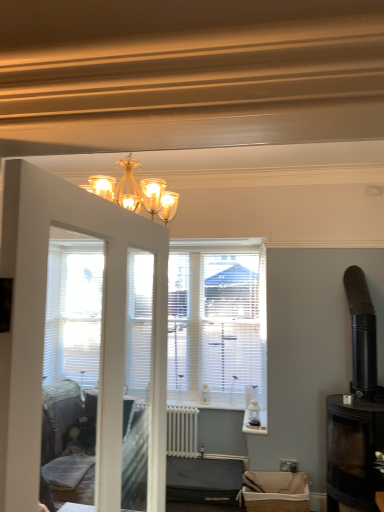
Find the location of a particular element. burlap basket at lower center, placed as the first furniture when sorted from right to left is located at coordinates (276, 490).

This screenshot has height=512, width=384. Describe the element at coordinates (276, 490) in the screenshot. I see `burlap basket at lower center, which ranks as the 2th furniture in left-to-right order` at that location.

What do you see at coordinates (182, 431) in the screenshot? The width and height of the screenshot is (384, 512). I see `white painted radiator at center` at bounding box center [182, 431].

You are a GUI agent. You are given a task and a screenshot of the screen. Output one action in this format:
    pyautogui.click(x=<x>, y=<y>)
    Task: Click on the gold metallic chandelier at upper center
    The width and height of the screenshot is (384, 512).
    Given the screenshot: What is the action you would take?
    pyautogui.click(x=74, y=329)

Locate an element on the screen. The width and height of the screenshot is (384, 512). burlap basket at lower center, placed as the first furniture when sorted from right to left is located at coordinates (276, 490).

In the scene shown: How distant is white painted radiator at center from black glass fireplace at right?

white painted radiator at center is 5.94 feet away from black glass fireplace at right.

Is white painted radiator at center oriented away from black glass fireplace at right?

white painted radiator at center is not turned away from black glass fireplace at right.

Considering the sizes of white painted radiator at center and black glass fireplace at right in the image, is white painted radiator at center bigger or smaller than black glass fireplace at right?

In the image, white painted radiator at center appears to be smaller than black glass fireplace at right.

How different are the orientations of white painted radiator at center and black glass fireplace at right in degrees?

The facing directions of white painted radiator at center and black glass fireplace at right are 89.3 degrees apart.

Relative to dark gray fabric sofa at lower center, the 1th furniture from the back, is gold metallic chandelier at upper center in front or behind?

gold metallic chandelier at upper center is in front of dark gray fabric sofa at lower center, the 1th furniture from the back.

Where is `screen door located above the dark gray fabric sofa at lower center, which appears as the first furniture when viewed from the left (from the image's perspective)`? screen door located above the dark gray fabric sofa at lower center, which appears as the first furniture when viewed from the left (from the image's perspective) is located at coordinates (74, 329).

Considering the relative sizes of gold metallic chandelier at upper center and dark gray fabric sofa at lower center, the 2th furniture when ordered from right to left, in the image provided, is gold metallic chandelier at upper center wider than dark gray fabric sofa at lower center, the 2th furniture when ordered from right to left,?

Yes, gold metallic chandelier at upper center is wider than dark gray fabric sofa at lower center, the 2th furniture when ordered from right to left.

Considering the sizes of objects dark gray fabric sofa at lower center, which is the second furniture in front-to-back order, and white painted radiator at center in the image provided, who is bigger, dark gray fabric sofa at lower center, which is the second furniture in front-to-back order, or white painted radiator at center?

With larger size is dark gray fabric sofa at lower center, which is the second furniture in front-to-back order.

Is dark gray fabric sofa at lower center, which is the second furniture in front-to-back order, at the right side of white painted radiator at center?

Correct, you'll find dark gray fabric sofa at lower center, which is the second furniture in front-to-back order, to the right of white painted radiator at center.

Is dark gray fabric sofa at lower center, the 1th furniture from the back, shorter than white painted radiator at center?

Yes.

Based on the photo, does burlap basket at lower center, the first furniture positioned from the front, touch gold metallic chandelier at upper center?

No, burlap basket at lower center, the first furniture positioned from the front, is not beside gold metallic chandelier at upper center.

Based on the photo, based on their sizes in the image, would you say burlap basket at lower center, marked as the 2th furniture in a back-to-front arrangement, is bigger or smaller than gold metallic chandelier at upper center?

burlap basket at lower center, marked as the 2th furniture in a back-to-front arrangement, is smaller than gold metallic chandelier at upper center.

Can we say burlap basket at lower center, the first furniture positioned from the front, lies outside gold metallic chandelier at upper center?

Indeed, burlap basket at lower center, the first furniture positioned from the front, is completely outside gold metallic chandelier at upper center.

Could you tell me if burlap basket at lower center, the first furniture positioned from the front, is facing black glass fireplace at right?

No, burlap basket at lower center, the first furniture positioned from the front, is not turned towards black glass fireplace at right.

Considering the sizes of burlap basket at lower center, marked as the 2th furniture in a back-to-front arrangement, and black glass fireplace at right in the image, is burlap basket at lower center, marked as the 2th furniture in a back-to-front arrangement, wider or thinner than black glass fireplace at right?

Considering their sizes, burlap basket at lower center, marked as the 2th furniture in a back-to-front arrangement, looks slimmer than black glass fireplace at right.

Between point (278, 509) and point (357, 293), which one is positioned behind?

Positioned behind is point (357, 293).

From the image's perspective, would you say burlap basket at lower center, marked as the 2th furniture in a back-to-front arrangement, is shown under black glass fireplace at right?

Indeed, from the image's perspective, burlap basket at lower center, marked as the 2th furniture in a back-to-front arrangement, is shown beneath black glass fireplace at right.

From the picture: From their relative heights in the image, would you say black glass fireplace at right is taller or shorter than dark gray fabric sofa at lower center, which appears as the first furniture when viewed from the left?

Considering their sizes, black glass fireplace at right has more height than dark gray fabric sofa at lower center, which appears as the first furniture when viewed from the left.

Visually, is black glass fireplace at right positioned to the left or to the right of dark gray fabric sofa at lower center, the 2th furniture when ordered from right to left?

From the image, it's evident that black glass fireplace at right is to the right of dark gray fabric sofa at lower center, the 2th furniture when ordered from right to left.

Looking at their sizes, would you say black glass fireplace at right is wider or thinner than dark gray fabric sofa at lower center, the 1th furniture from the back?

Clearly, black glass fireplace at right has less width compared to dark gray fabric sofa at lower center, the 1th furniture from the back.

From the picture: Would you consider black glass fireplace at right to be distant from dark gray fabric sofa at lower center, which appears as the first furniture when viewed from the left?

black glass fireplace at right is far away from dark gray fabric sofa at lower center, which appears as the first furniture when viewed from the left.

Could you measure the distance between gold metallic chandelier at upper center and burlap basket at lower center, placed as the first furniture when sorted from right to left?

A distance of 7.74 feet exists between gold metallic chandelier at upper center and burlap basket at lower center, placed as the first furniture when sorted from right to left.

Between gold metallic chandelier at upper center and burlap basket at lower center, the first furniture positioned from the front, which one has larger size?

Bigger between the two is gold metallic chandelier at upper center.

From a real-world perspective, which furniture is the 1st one underneath the gold metallic chandelier at upper center? Please provide its 2D coordinates.

[(276, 490)]

From the image's perspective, who appears lower, gold metallic chandelier at upper center or burlap basket at lower center, which ranks as the 2th furniture in left-to-right order?

burlap basket at lower center, which ranks as the 2th furniture in left-to-right order.

Locate an element on the screen. radiator below the black glass fireplace at right (from a real-world perspective) is located at coordinates (182, 431).

This screenshot has height=512, width=384. Identify the location of the 2nd furniture below when counting from the gold metallic chandelier at upper center (from the image's perspective). (204, 480).

Which object lies further to the anchor point black glass fireplace at right, burlap basket at lower center, which ranks as the 2th furniture in left-to-right order, or gold metallic chandelier at upper center?

The object further to black glass fireplace at right is gold metallic chandelier at upper center.

Which object lies further to the anchor point white painted radiator at center, gold metallic chandelier at upper center or dark gray fabric sofa at lower center, which is the second furniture in front-to-back order?

gold metallic chandelier at upper center is positioned further to the anchor white painted radiator at center.

Looking at the image, which one is located closer to gold metallic chandelier at upper center, white painted radiator at center or black glass fireplace at right?

Based on the image, white painted radiator at center appears to be nearer to gold metallic chandelier at upper center.

Based on their spatial positions, is black glass fireplace at right or burlap basket at lower center, marked as the 2th furniture in a back-to-front arrangement, closer to gold metallic chandelier at upper center?

burlap basket at lower center, marked as the 2th furniture in a back-to-front arrangement, is closer to gold metallic chandelier at upper center.

From the image, which object appears to be nearer to dark gray fabric sofa at lower center, which is the second furniture in front-to-back order, white painted radiator at center or black glass fireplace at right?

white painted radiator at center.

From the picture: Which object lies nearer to the anchor point burlap basket at lower center, which ranks as the 2th furniture in left-to-right order, gold metallic chandelier at upper center or white painted radiator at center?

Among the two, white painted radiator at center is located nearer to burlap basket at lower center, which ranks as the 2th furniture in left-to-right order.

When comparing their distances from burlap basket at lower center, which ranks as the 2th furniture in left-to-right order, does white painted radiator at center or black glass fireplace at right seem closer?

black glass fireplace at right lies closer to burlap basket at lower center, which ranks as the 2th furniture in left-to-right order, than the other object.

When comparing their distances from gold metallic chandelier at upper center, does burlap basket at lower center, placed as the first furniture when sorted from right to left, or black glass fireplace at right seem closer?

burlap basket at lower center, placed as the first furniture when sorted from right to left, lies closer to gold metallic chandelier at upper center than the other object.

Where is `fireplace between gold metallic chandelier at upper center and white painted radiator at center along the z-axis`? fireplace between gold metallic chandelier at upper center and white painted radiator at center along the z-axis is located at coordinates (356, 411).

You are a GUI agent. You are given a task and a screenshot of the screen. Output one action in this format:
    pyautogui.click(x=<x>, y=<y>)
    Task: Click on the fireplace between gold metallic chandelier at upper center and burlap basket at lower center, which ranks as the 2th furniture in left-to-right order, along the z-axis
    
    Given the screenshot: What is the action you would take?
    pyautogui.click(x=356, y=411)

You are a GUI agent. You are given a task and a screenshot of the screen. Output one action in this format:
    pyautogui.click(x=<x>, y=<y>)
    Task: Click on the furniture positioned between burlap basket at lower center, placed as the first furniture when sorted from right to left, and white painted radiator at center from near to far
    
    Given the screenshot: What is the action you would take?
    204,480

The height and width of the screenshot is (512, 384). I want to click on furniture between dark gray fabric sofa at lower center, the 2th furniture when ordered from right to left, and black glass fireplace at right, in the horizontal direction, so click(x=276, y=490).